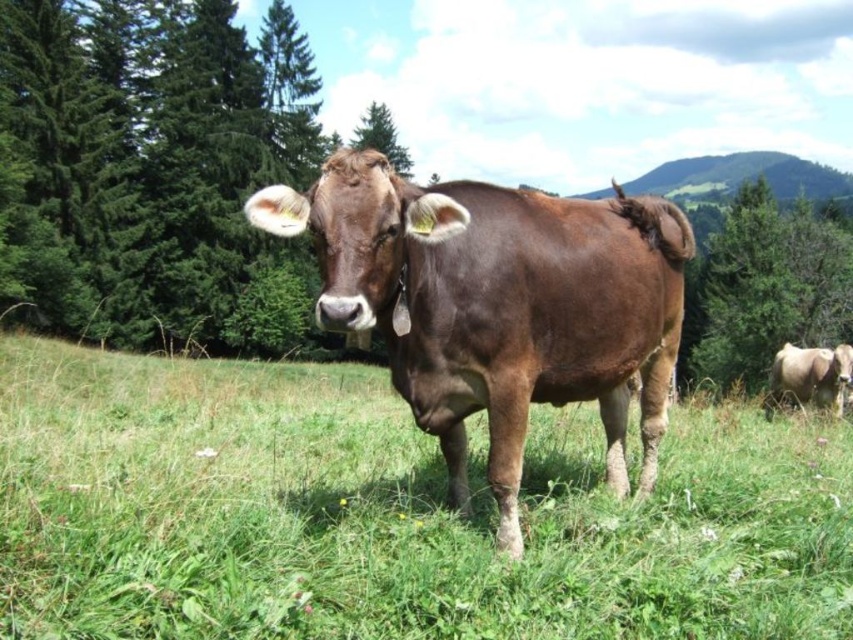
Between green textured tree at left and brown smooth cow at center, which one has more height?

green textured tree at left

Can you confirm if green textured tree at left is shorter than brown smooth cow at center?

No, green textured tree at left is not shorter than brown smooth cow at center.

Is point (236, 268) farther from camera compared to point (663, 387)?

Yes, it is.

Where is `green textured tree at left`? The height and width of the screenshot is (640, 853). green textured tree at left is located at coordinates (154, 173).

Is green grassy at center behind brown smooth cow at center?

Yes, green grassy at center is behind brown smooth cow at center.

Which is more to the right, green grassy at center or brown smooth cow at center?

brown smooth cow at center

The height and width of the screenshot is (640, 853). Find the location of `green grassy at center`. green grassy at center is located at coordinates (389, 513).

Where is `green grassy at center`? The height and width of the screenshot is (640, 853). green grassy at center is located at coordinates (389, 513).

Describe the element at coordinates (498, 305) in the screenshot. I see `brown smooth cow at center` at that location.

Image resolution: width=853 pixels, height=640 pixels. In order to click on brown smooth cow at center in this screenshot , I will do `click(498, 305)`.